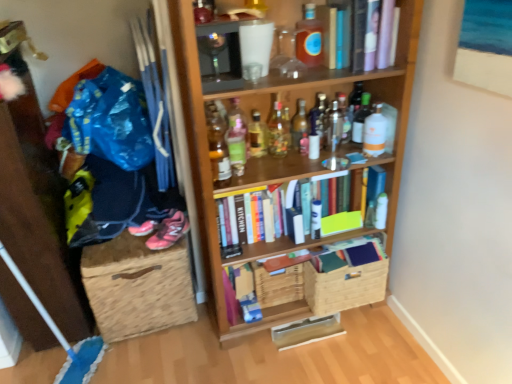
Find the location of `vacant area that is situated to the right of translucent plastic bottle at center, the 2th bottle in the left-to-right sequence`. vacant area that is situated to the right of translucent plastic bottle at center, the 2th bottle in the left-to-right sequence is located at coordinates (266, 172).